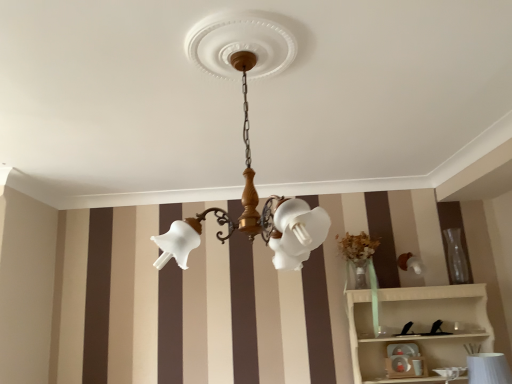
Question: Is white wood shelf at lower right completely or partially inside matte white glass chandelier at center?

Choices:
 (A) no
 (B) yes

Answer: (A)

Question: Does matte white glass chandelier at center have a lesser height compared to white wood shelf at lower right?

Choices:
 (A) no
 (B) yes

Answer: (A)

Question: Considering the relative positions of matte white glass chandelier at center and white wood shelf at lower right in the image provided, is matte white glass chandelier at center to the left of white wood shelf at lower right from the viewer's perspective?

Choices:
 (A) no
 (B) yes

Answer: (B)

Question: From the image's perspective, is matte white glass chandelier at center located above white wood shelf at lower right?

Choices:
 (A) yes
 (B) no

Answer: (A)

Question: Is matte white glass chandelier at center closer to camera compared to white wood shelf at lower right?

Choices:
 (A) no
 (B) yes

Answer: (B)

Question: Considering the relative sizes of matte white glass chandelier at center and white wood shelf at lower right in the image provided, is matte white glass chandelier at center smaller than white wood shelf at lower right?

Choices:
 (A) yes
 (B) no

Answer: (A)

Question: Does white wood shelf at lower right have a greater height compared to white textured vase at lower right?

Choices:
 (A) no
 (B) yes

Answer: (B)

Question: Considering the relative sizes of white wood shelf at lower right and white textured vase at lower right in the image provided, is white wood shelf at lower right wider than white textured vase at lower right?

Choices:
 (A) yes
 (B) no

Answer: (A)

Question: Is white wood shelf at lower right turned away from white textured vase at lower right?

Choices:
 (A) no
 (B) yes

Answer: (B)

Question: Is white wood shelf at lower right thinner than white textured vase at lower right?

Choices:
 (A) no
 (B) yes

Answer: (A)

Question: From a real-world perspective, is white wood shelf at lower right positioned under white textured vase at lower right based on gravity?

Choices:
 (A) no
 (B) yes

Answer: (A)

Question: Is white wood shelf at lower right facing towards white textured vase at lower right?

Choices:
 (A) yes
 (B) no

Answer: (A)

Question: From a real-world perspective, is matte white toy at lower center beneath white wood shelf at lower right?

Choices:
 (A) yes
 (B) no

Answer: (A)